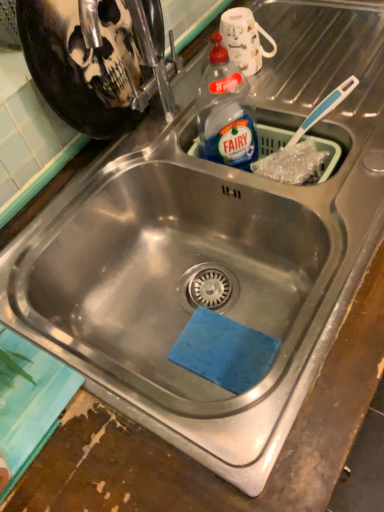
Question: Is transparent plastic bottle at upper right taller or shorter than white glossy mug at upper center?

Choices:
 (A) short
 (B) tall

Answer: (B)

Question: Would you say transparent plastic bottle at upper right is to the left or to the right of white glossy mug at upper center in the picture?

Choices:
 (A) right
 (B) left

Answer: (B)

Question: In terms of size, does transparent plastic bottle at upper right appear bigger or smaller than white glossy mug at upper center?

Choices:
 (A) small
 (B) big

Answer: (B)

Question: From a real-world perspective, relative to transparent plastic bottle at upper right, is white glossy mug at upper center vertically above or below?

Choices:
 (A) above
 (B) below

Answer: (A)

Question: Is white glossy mug at upper center to the left or to the right of transparent plastic bottle at upper right in the image?

Choices:
 (A) right
 (B) left

Answer: (A)

Question: From their relative heights in the image, would you say white glossy mug at upper center is taller or shorter than transparent plastic bottle at upper right?

Choices:
 (A) tall
 (B) short

Answer: (B)

Question: Relative to transparent plastic bottle at upper right, is white glossy mug at upper center in front or behind?

Choices:
 (A) behind
 (B) front

Answer: (A)